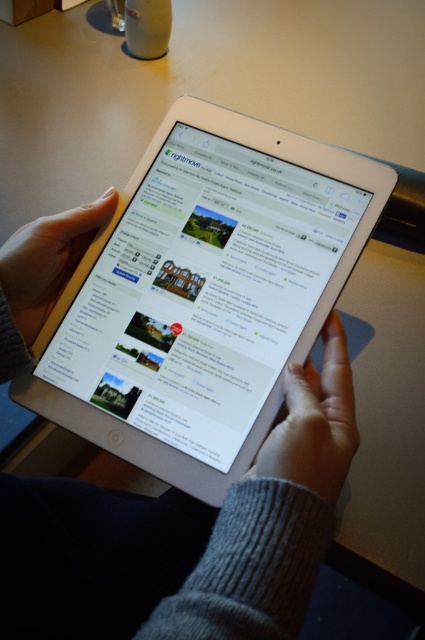
Question: Does silver metallic tablet at center have a lesser width compared to gray woolen sweater at lower center?

Choices:
 (A) yes
 (B) no

Answer: (B)

Question: Which object is farther from the camera taking this photo?

Choices:
 (A) smooth yellow finger at center
 (B) silver metallic tablet at center

Answer: (A)

Question: Is gray woolen sweater at lower center behind smooth yellow finger at center?

Choices:
 (A) no
 (B) yes

Answer: (A)

Question: Based on their relative distances, which object is nearer to the gray woolen sweater at lower center?

Choices:
 (A) silver metallic tablet at center
 (B) smooth yellow finger at center

Answer: (A)

Question: Which point is farther to the camera?

Choices:
 (A) (155, 182)
 (B) (334, 321)
 (C) (40, 260)

Answer: (A)

Question: Can you confirm if silver metallic tablet at center is smaller than smooth yellow finger at center?

Choices:
 (A) yes
 (B) no

Answer: (B)